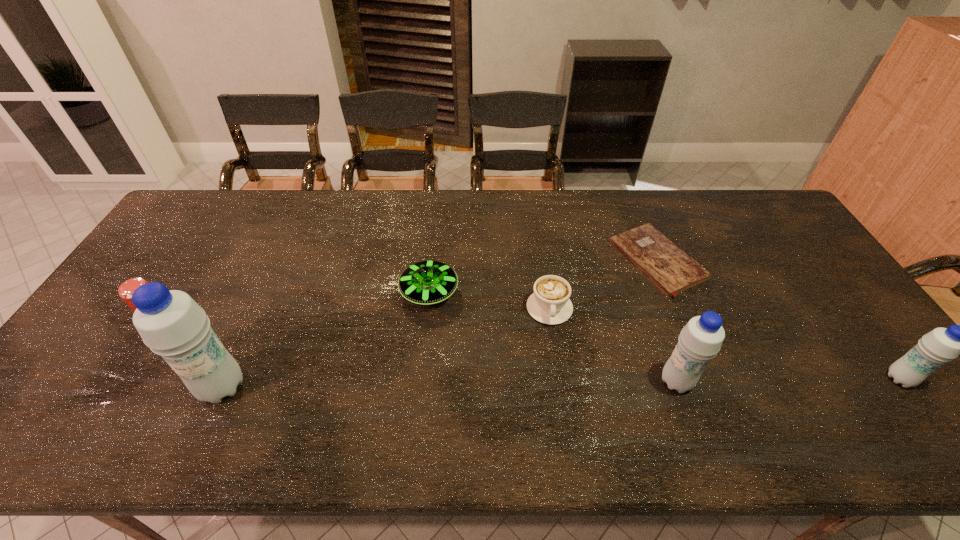
The width and height of the screenshot is (960, 540). Find the location of `the fourth object from left to right`. the fourth object from left to right is located at coordinates (550, 304).

The width and height of the screenshot is (960, 540). What are the coordinates of `free space located 0.210m on the back of the second object from left to right` in the screenshot? It's located at 261,302.

This screenshot has height=540, width=960. I want to click on vacant space located 0.310m on the left of the second tallest water bottle, so click(532, 382).

Locate an element on the screen. vacant space located 0.240m on the left of the shortest water bottle is located at coordinates (788, 379).

Locate an element on the screen. The width and height of the screenshot is (960, 540). vacant space located on the left of the Bible is located at coordinates (563, 261).

This screenshot has height=540, width=960. Identify the location of vacant space located 0.310m on the right of the beer can. (281, 316).

Identify the location of free space located 0.070m on the back of the saucer. (433, 255).

This screenshot has height=540, width=960. Find the location of `vacant space located 0.080m to the right of the fourth object from right to left's handle`. vacant space located 0.080m to the right of the fourth object from right to left's handle is located at coordinates (556, 353).

Identify the location of object positioned at the far edge. This screenshot has width=960, height=540. (670, 269).

Where is `object at the left edge`? This screenshot has width=960, height=540. object at the left edge is located at coordinates (126, 289).